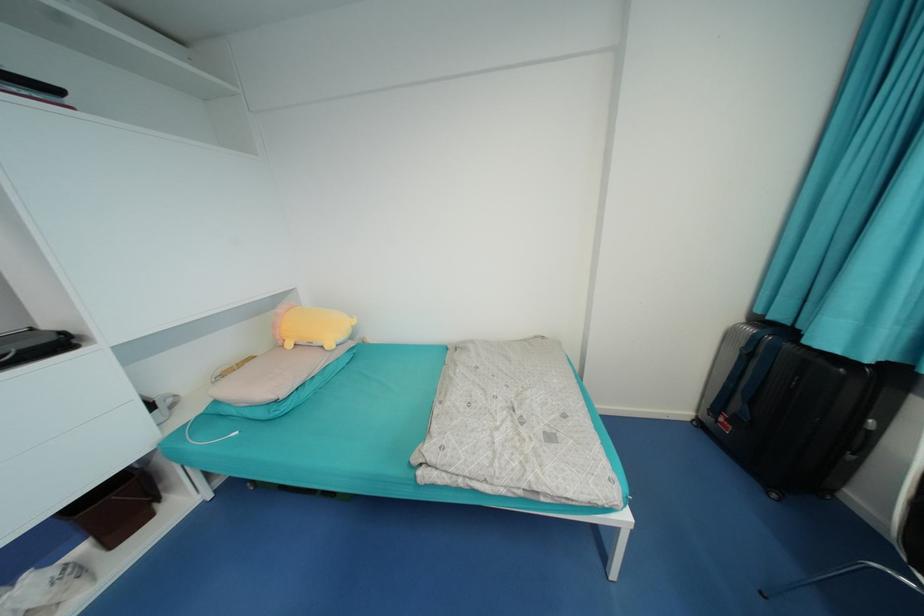
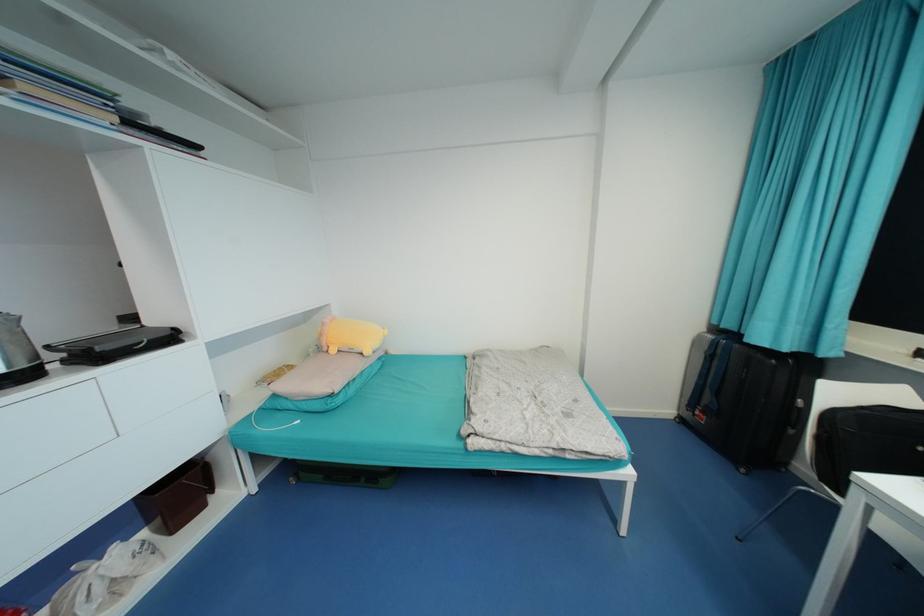
In a continuous first-person perspective shot, in which direction is the camera moving?

The cameraman moved toward left, backward.